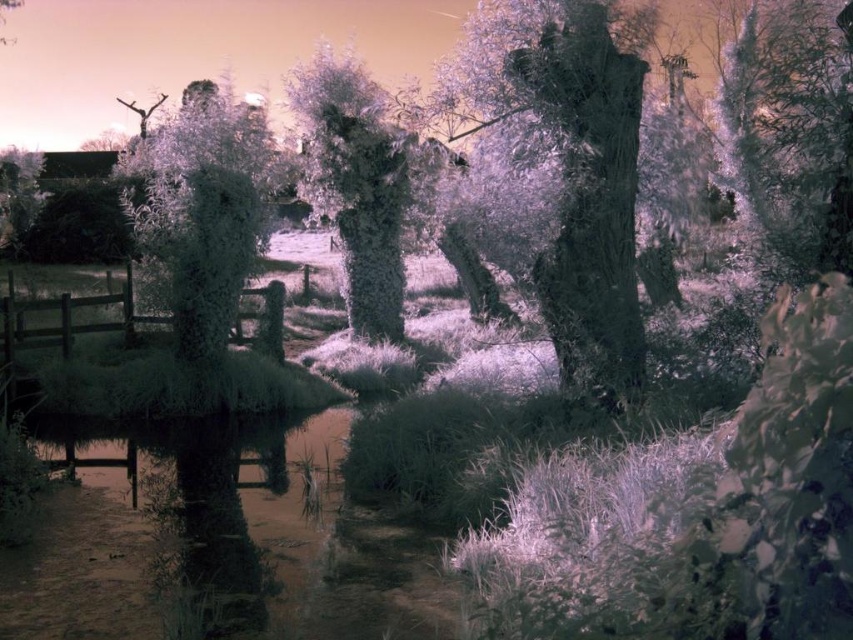
Looking at this image, in the surreal infrared landscape, where exactly is the frosted glass tree at upper left located?

The frosted glass tree at upper left is located at point (209,221).

You are an artist trying to capture the scene in the image. You notice the frosted glass tree at upper left and the silvery textured tree at center. Which tree is located more to the left side of the other?

The frosted glass tree at upper left is positioned on the left side of silvery textured tree at center, so it is more to the left.